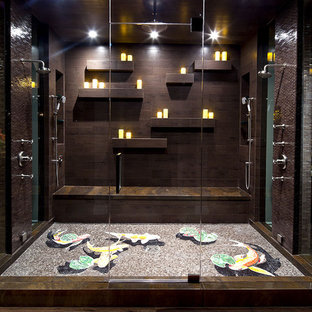
This screenshot has width=312, height=312. I want to click on shower head, so click(264, 71), click(44, 68).